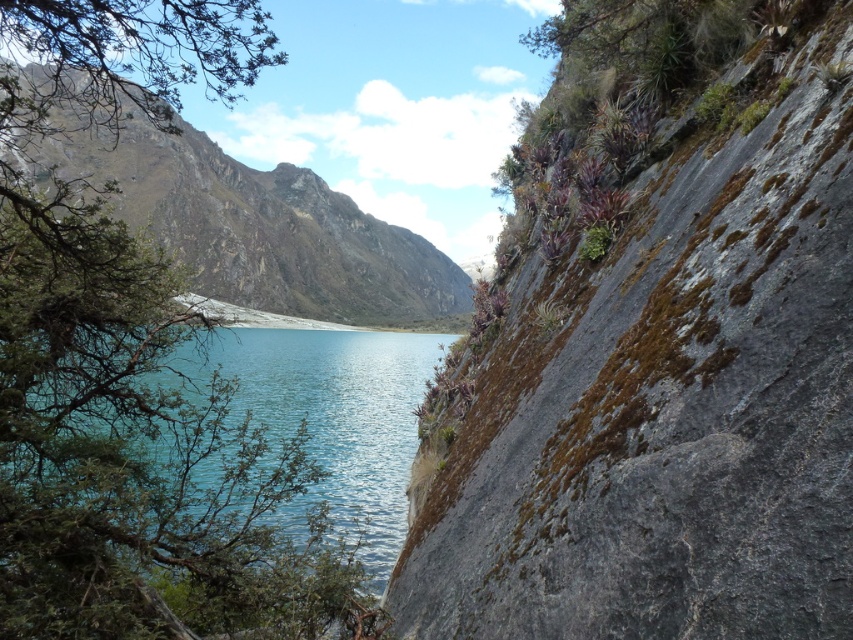
Based on the photo, you are a hiker standing at the base of the rugged stone mountain at center. You want to reach the summit. According to the map, the summit is at point (x=262, y=228). Is the summit directly in front of you?

The rugged stone mountain at center is located at point (x=262, y=228), so yes, the summit is directly in front of you.

You are standing at the center of the image and want to reach the green mossy rock at right. Which direction should you move in to get there?

You should move to the right to reach the green mossy rock at right since it is located at the right side of the image.